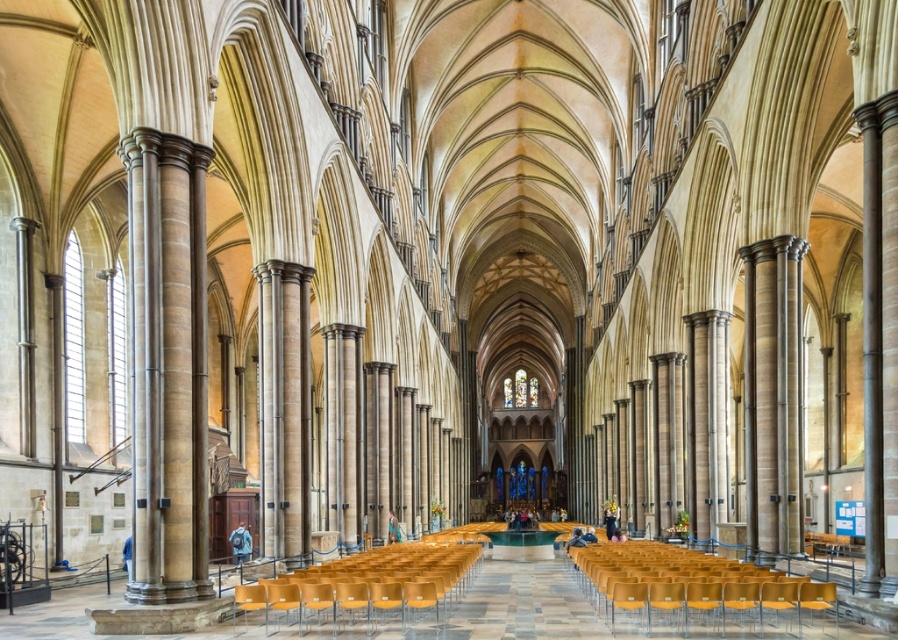
Question: From the image, what is the correct spatial relationship of matte yellow chairs at lower center in relation to matte yellow chairs at center?

Choices:
 (A) right
 (B) left

Answer: (A)

Question: Which of the following is the closest to the observer?

Choices:
 (A) matte yellow chairs at center
 (B) matte yellow chairs at lower center

Answer: (B)

Question: Is matte yellow chairs at lower center to the right of matte yellow chairs at center from the viewer's perspective?

Choices:
 (A) yes
 (B) no

Answer: (A)

Question: Among these objects, which one is nearest to the camera?

Choices:
 (A) matte yellow chairs at lower center
 (B) matte yellow chairs at center

Answer: (A)

Question: Is matte yellow chairs at lower center further to the viewer compared to matte yellow chairs at center?

Choices:
 (A) no
 (B) yes

Answer: (A)